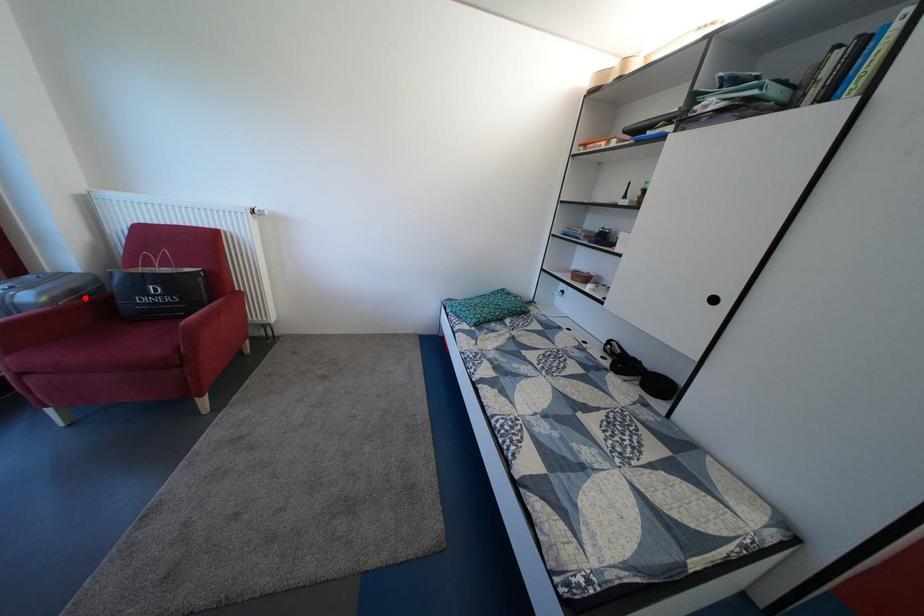
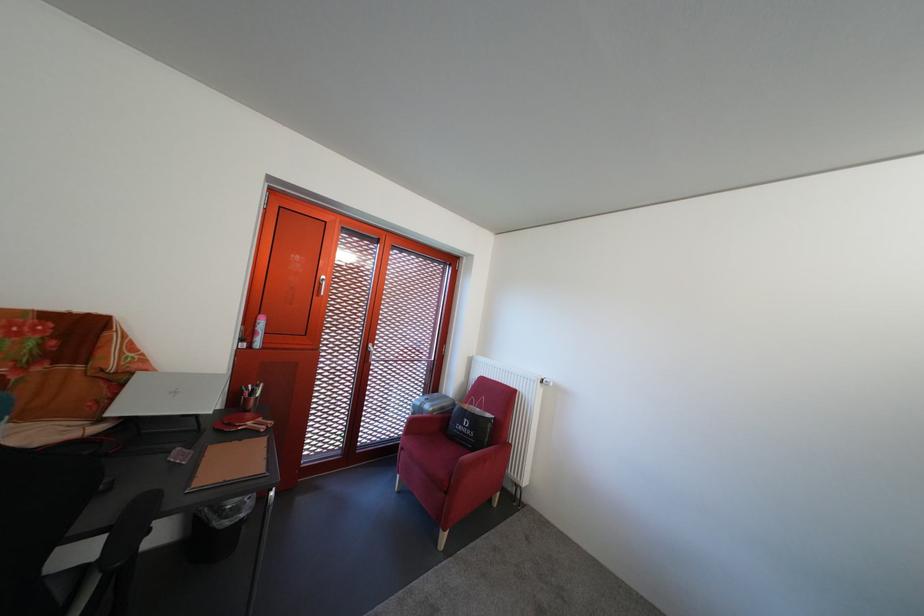
Find the pixel in the second image that matches the highlighted location in the first image.

(454, 415)